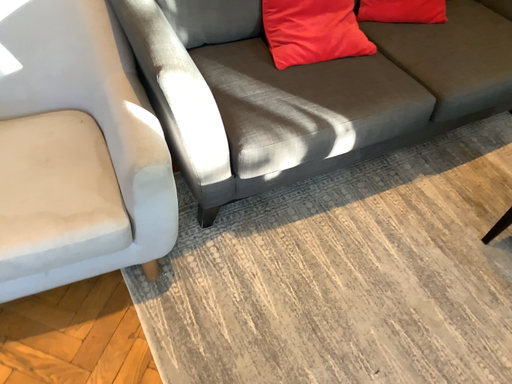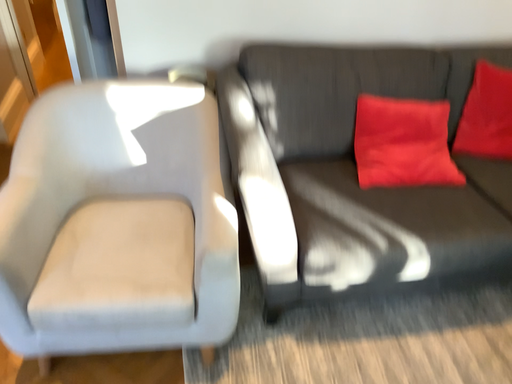
Question: Which way did the camera rotate in the video?

Choices:
 (A) rotated right
 (B) rotated left

Answer: (B)